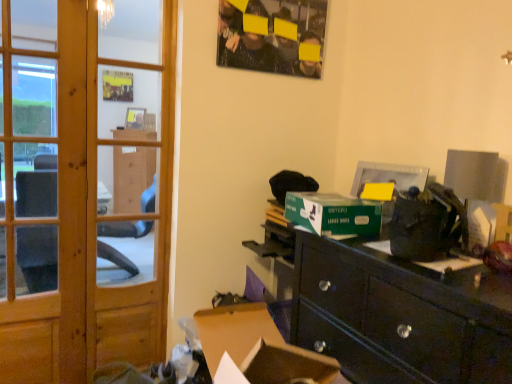
Identify the location of green cardboard box at center. The image size is (512, 384). (334, 215).

Based on their positions, is wooden door at left located to the left or right of wooden screen door at left?

wooden door at left is positioned on wooden screen door at left's left side.

Measure the distance between wooden door at left and wooden screen door at left.

wooden door at left is 3.48 feet away from wooden screen door at left.

Based on the photo, is wooden door at left far from wooden screen door at left?

wooden door at left is far away from wooden screen door at left.

From the image's perspective, which is below, wooden door at left or wooden screen door at left?

wooden door at left.

Is wooden screen door at left located outside brown cardboard box at lower center?

wooden screen door at left lies outside brown cardboard box at lower center's area.

Considering the positions of objects wooden screen door at left and brown cardboard box at lower center in the image provided, who is more to the left, wooden screen door at left or brown cardboard box at lower center?

wooden screen door at left.

Which is less distant, [134,354] or [220,342]?

Point [134,354].

Considering the sizes of objects wooden screen door at left and brown cardboard box at lower center in the image provided, who is taller, wooden screen door at left or brown cardboard box at lower center?

wooden screen door at left.

How distant is black glossy desk at lower right from wooden screen door at left?

black glossy desk at lower right is 2.05 meters away from wooden screen door at left.

From a real-world perspective, which object stands above the other?

wooden screen door at left, from a real-world perspective.

Is black glossy desk at lower right behind wooden screen door at left?

No.

Is black glossy desk at lower right next to wooden screen door at left?

They are not placed beside each other.

In the scene shown: Is black glossy desk at lower right looking in the opposite direction of wooden door at left?

No, black glossy desk at lower right's orientation is not away from wooden door at left.

Which is more to the left, black glossy desk at lower right or wooden door at left?

From the viewer's perspective, wooden door at left appears more on the left side.

Between point (464, 329) and point (170, 114), which one is positioned behind?

Positioned behind is point (170, 114).

Between black glossy desk at lower right and wooden door at left, which one has smaller width?

wooden door at left.

From the image's perspective, would you say wooden screen door at left is positioned over matte black poster at upper center?

Actually, wooden screen door at left appears below matte black poster at upper center in the image.

Measure the distance between wooden screen door at left and matte black poster at upper center.

wooden screen door at left is 1.73 meters from matte black poster at upper center.

Is wooden screen door at left bigger than matte black poster at upper center?

Indeed, wooden screen door at left has a larger size compared to matte black poster at upper center.

Is wooden screen door at left in front of or behind matte black poster at upper center in the image?

In the image, wooden screen door at left appears in front of matte black poster at upper center.

From the image's perspective, is brown cardboard box at lower center positioned above or below green cardboard box at center?

brown cardboard box at lower center is below green cardboard box at center.

Measure the distance from brown cardboard box at lower center to green cardboard box at center.

The distance of brown cardboard box at lower center from green cardboard box at center is 45.50 centimeters.

From the picture: Is brown cardboard box at lower center looking in the opposite direction of green cardboard box at center?

No.

Is black glossy desk at lower right inside the boundaries of brown cardboard box at lower center, or outside?

black glossy desk at lower right cannot be found inside brown cardboard box at lower center.

Where is `desk that appears on the right of brown cardboard box at lower center`? desk that appears on the right of brown cardboard box at lower center is located at coordinates (399, 317).

Consider the image. Relative to brown cardboard box at lower center, is black glossy desk at lower right in front or behind?

In the image, black glossy desk at lower right appears in front of brown cardboard box at lower center.

Is black glossy desk at lower right in contact with brown cardboard box at lower center?

black glossy desk at lower right is not next to brown cardboard box at lower center, and they're not touching.

This screenshot has width=512, height=384. Identify the location of door below the wooden screen door at left (from a real-world perspective). (84, 185).

Image resolution: width=512 pixels, height=384 pixels. Find the location of `screen door behind the brown cardboard box at lower center`. screen door behind the brown cardboard box at lower center is located at coordinates (133, 179).

From the picture: Which object lies further to the anchor point wooden screen door at left, black glossy desk at lower right or wooden door at left?

black glossy desk at lower right lies further to wooden screen door at left than the other object.

From the image, which object appears to be farther from matte black poster at upper center, wooden door at left or brown cardboard box at lower center?

The object further to matte black poster at upper center is brown cardboard box at lower center.

From the image, which object appears to be nearer to black glossy desk at lower right, wooden screen door at left or wooden door at left?

wooden door at left lies closer to black glossy desk at lower right than the other object.

Estimate the real-world distances between objects in this image. Which object is further from wooden screen door at left, wooden door at left or brown cardboard box at lower center?

Based on the image, brown cardboard box at lower center appears to be further to wooden screen door at left.

Looking at the image, which one is located further to wooden screen door at left, brown cardboard box at lower center or black glossy desk at lower right?

Among the two, black glossy desk at lower right is located further to wooden screen door at left.

When comparing their distances from brown cardboard box at lower center, does wooden door at left or green cardboard box at center seem further?

wooden door at left.

When comparing their distances from brown cardboard box at lower center, does wooden door at left or wooden screen door at left seem closer?

Among the two, wooden door at left is located nearer to brown cardboard box at lower center.

When comparing their distances from matte black poster at upper center, does brown cardboard box at lower center or wooden screen door at left seem closer?

brown cardboard box at lower center is closer to matte black poster at upper center.

The width and height of the screenshot is (512, 384). What are the coordinates of `screen door between matte black poster at upper center and green cardboard box at center vertically` in the screenshot? It's located at (133, 179).

In order to click on screen door between matte black poster at upper center and black glossy desk at lower right vertically in this screenshot , I will do `click(133, 179)`.

Identify the location of cardboard box between wooden screen door at left and black glossy desk at lower right. (334, 215).

Locate an element on the screen. Image resolution: width=512 pixels, height=384 pixels. computer desk between wooden door at left and green cardboard box at center in the horizontal direction is located at coordinates (249, 339).